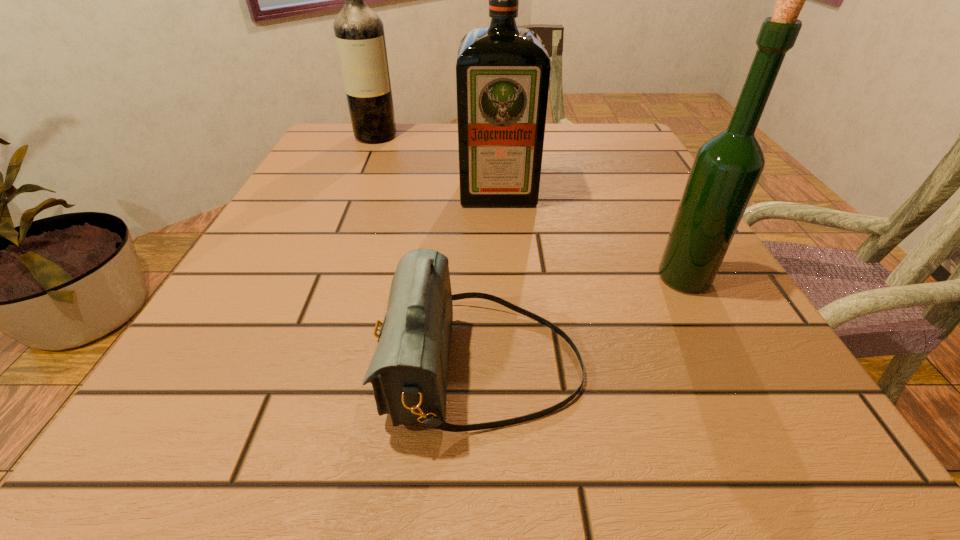
You are a GUI agent. You are given a task and a screenshot of the screen. Output one action in this format:
    pyautogui.click(x=<x>, y=<y>)
    Task: Click on the blank space located 0.350m on the front label of the second farthest object
    
    Given the screenshot: What is the action you would take?
    pyautogui.click(x=508, y=347)

Locate an element on the screen. This screenshot has height=540, width=960. vacant space located on the left of the shortest object is located at coordinates (239, 366).

You are a GUI agent. You are given a task and a screenshot of the screen. Output one action in this format:
    pyautogui.click(x=<x>, y=<y>)
    Task: Click on the object at the far edge
    This screenshot has width=960, height=540.
    Given the screenshot: What is the action you would take?
    pyautogui.click(x=359, y=32)

Where is `object situated at the near edge`? This screenshot has width=960, height=540. object situated at the near edge is located at coordinates (408, 372).

The width and height of the screenshot is (960, 540). Find the location of `object situated at the left edge`. object situated at the left edge is located at coordinates [359, 32].

Locate an element on the screen. This screenshot has width=960, height=540. object that is positioned at the right edge is located at coordinates (726, 169).

Locate an element on the screen. object that is at the far left corner is located at coordinates pyautogui.click(x=359, y=32).

I want to click on free location at the far edge of the desktop, so click(x=390, y=143).

At what (x,y) coordinates should I click in order to perform the action: click on free space at the near edge of the desktop. Please return your answer as a coordinate pair (x, y). Looking at the image, I should click on (401, 460).

Where is `free space at the left edge`? The image size is (960, 540). free space at the left edge is located at coordinates (295, 198).